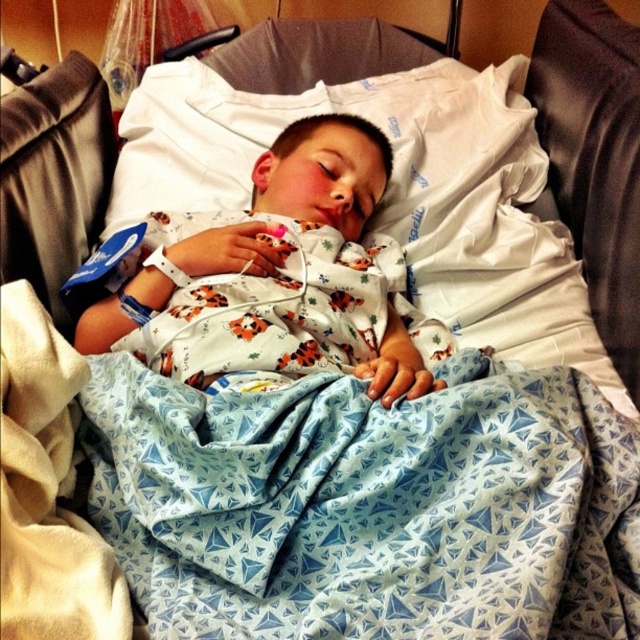
Question: Which point is farther to the camera?

Choices:
 (A) white cotton pajamas at center
 (B) blue printed fabric at center

Answer: (A)

Question: From the image, what is the correct spatial relationship of blue printed fabric at center in relation to white cotton pajamas at center?

Choices:
 (A) left
 (B) right

Answer: (B)

Question: Is blue printed fabric at center smaller than white cotton pajamas at center?

Choices:
 (A) yes
 (B) no

Answer: (A)

Question: Is blue printed fabric at center below white cotton pajamas at center?

Choices:
 (A) yes
 (B) no

Answer: (A)